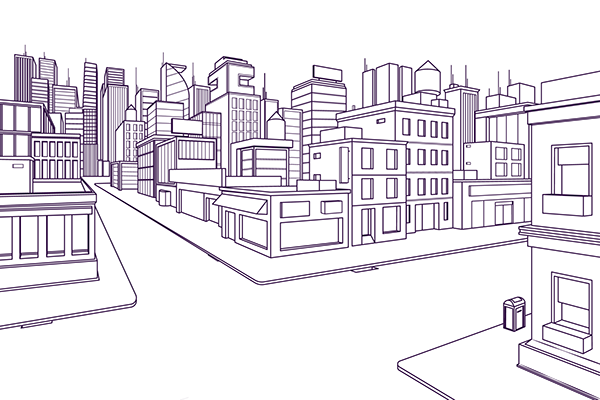
Image resolution: width=600 pixels, height=400 pixels. Identify the location of top of trash can. (514, 300).